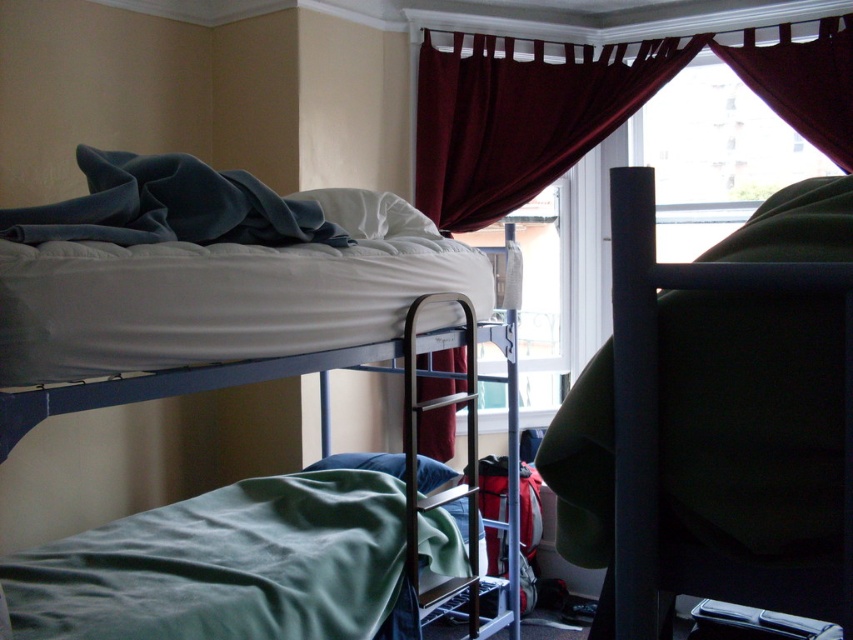
Question: Is velvet burgundy curtain at upper center bigger than green fabric pillow at lower center?

Choices:
 (A) yes
 (B) no

Answer: (A)

Question: Which object is the closest to the blue fleece blanket at upper left?

Choices:
 (A) white matte bunk bed at upper left
 (B) metallic silver ladder at center
 (C) green soft blanket at lower left

Answer: (A)

Question: Among these points, which one is farthest from the camera?

Choices:
 (A) (515, 340)
 (B) (32, 605)
 (C) (294, 227)
 (D) (431, 484)

Answer: (A)

Question: Is velvet burgundy curtain at upper center thinner than blue fleece blanket at upper left?

Choices:
 (A) no
 (B) yes

Answer: (A)

Question: Can you confirm if velvet burgundy curtain at upper center is positioned to the left of green fabric pillow at lower center?

Choices:
 (A) yes
 (B) no

Answer: (B)

Question: Which point is closer to the camera taking this photo?

Choices:
 (A) (573, 84)
 (B) (322, 348)
 (C) (357, 621)

Answer: (B)